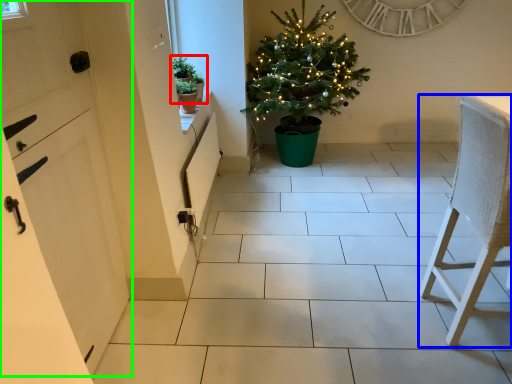
Question: Estimate the real-world distances between objects in this image. Which object is closer to houseplant (highlighted by a red box), furniture (highlighted by a blue box) or door (highlighted by a green box)?

Choices:
 (A) furniture
 (B) door

Answer: (B)